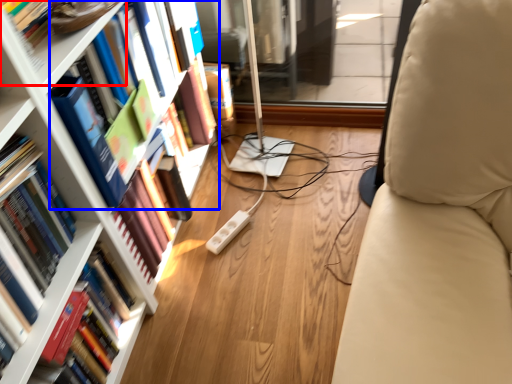
Question: Which of the following is the farthest to the observer, shelf (highlighted by a red box) or book (highlighted by a blue box)?

Choices:
 (A) shelf
 (B) book

Answer: (B)